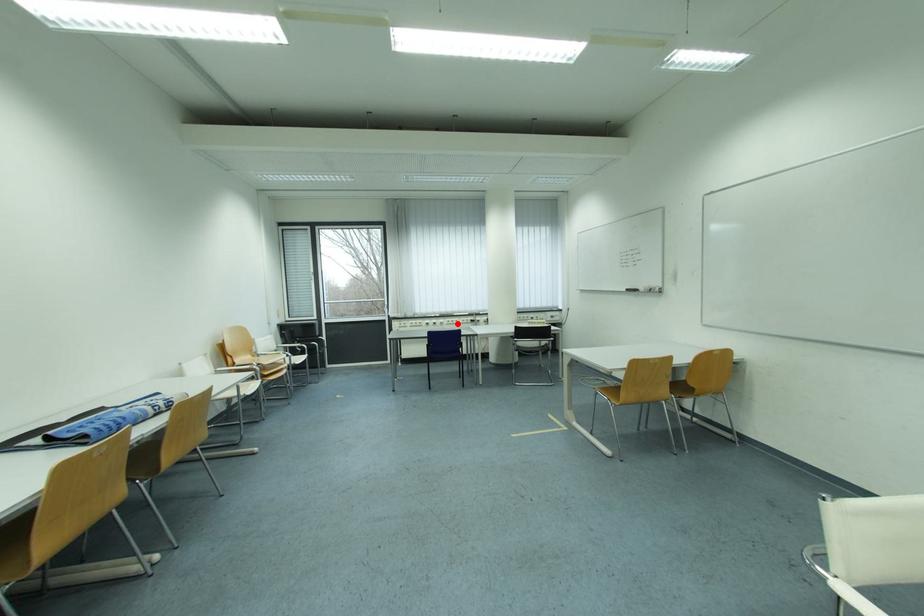
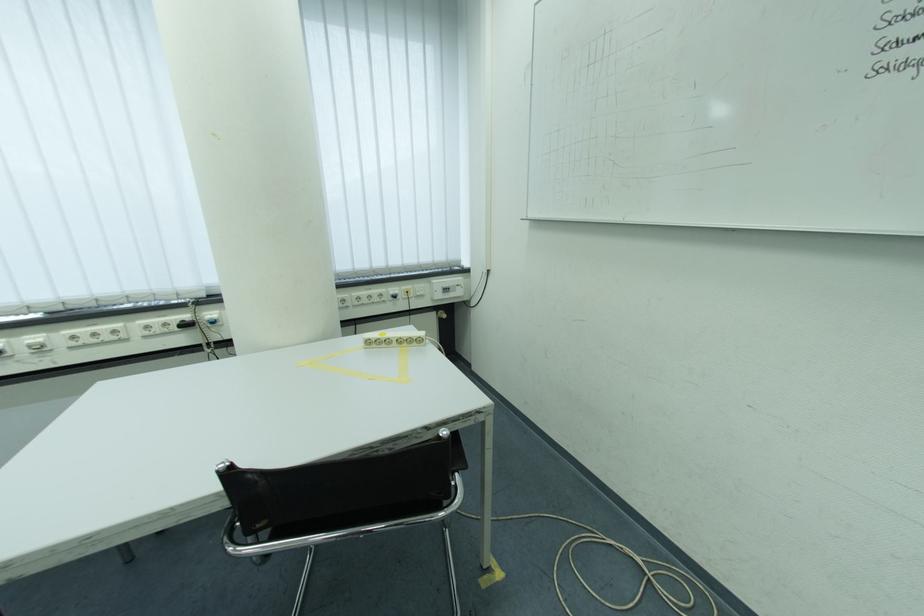
The point at the highlighted location is marked in the first image. Where is the corresponding point in the second image?

(82, 339)